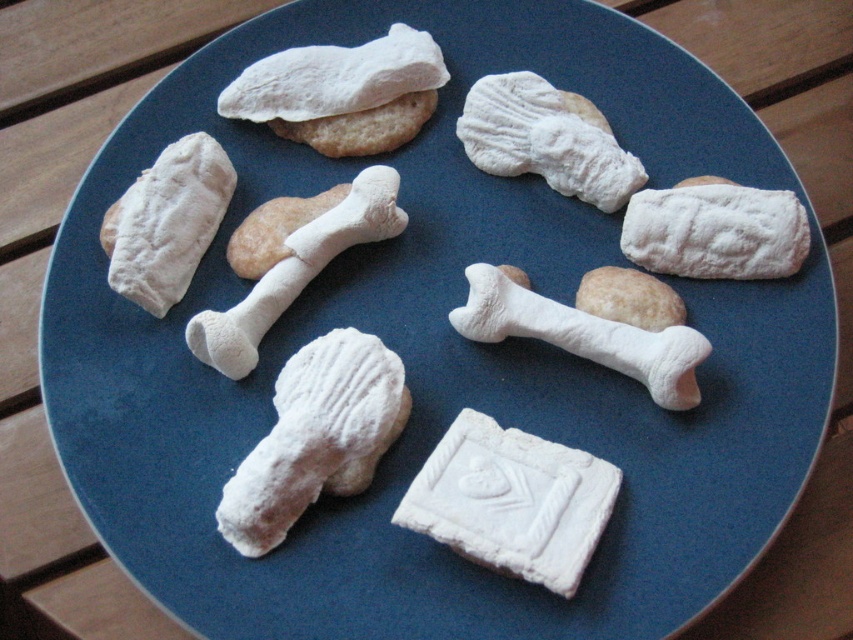
You are a dog owner trying to choose a treat for your pet. You see the white matte bone at center and the white fluffy bone at center on the plate. Which one is easier to grab quickly?

The white matte bone at center is closer to the viewer than the white fluffy bone at center, so it is easier to grab quickly.

You are a dog owner who wants to give your pet a treat. You see the powdered white bone at upper center and the white fluffy bone at center on the plate. Which treat is located to the right of the other?

The powdered white bone at upper center is positioned on the right side of the white fluffy bone at center.

You are a dog owner trying to place a new treat on the plate. The plate has a white matte bone at center. Where should you place the new treat to ensure it is on the same spot as the point labeled as point (583, 336)?

The point (583, 336) is located on the white matte bone at center, so placing the new treat there would position it on the white matte bone at center.